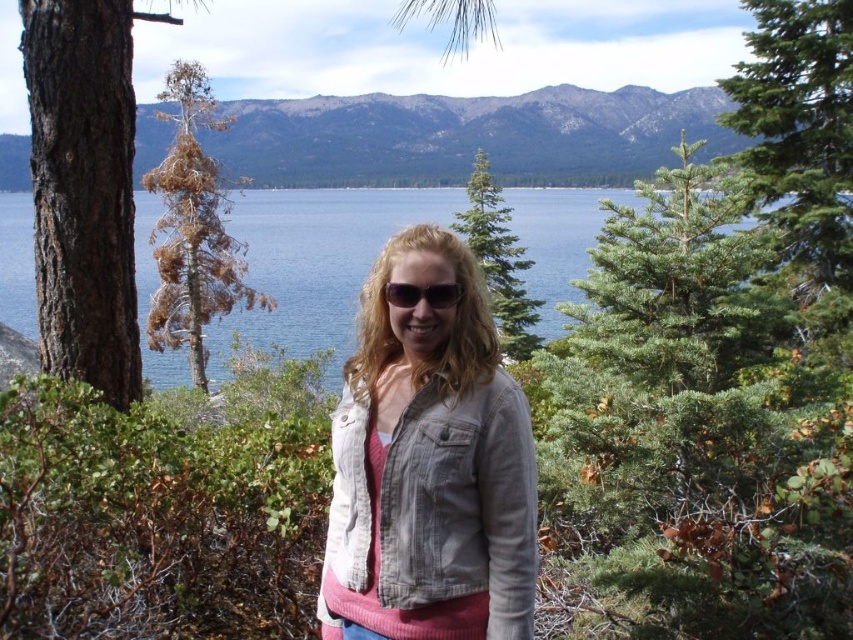
Question: Does blue water at center appear on the right side of sunglasses at center?

Choices:
 (A) yes
 (B) no

Answer: (B)

Question: Which point is closer to the camera taking this photo?

Choices:
 (A) (183, 104)
 (B) (268, 289)
 (C) (54, 131)

Answer: (C)

Question: Which point is farther to the camera?

Choices:
 (A) blue water at center
 (B) dark brown rough bark at left
 (C) green textured pine tree at center

Answer: (C)

Question: Considering the relative positions of blue water at center and brown/dried wood tree at left in the image provided, where is blue water at center located with respect to brown/dried wood tree at left?

Choices:
 (A) left
 (B) right

Answer: (B)

Question: Considering the relative positions of blue water at center and brown/dried wood tree at left in the image provided, where is blue water at center located with respect to brown/dried wood tree at left?

Choices:
 (A) right
 (B) left

Answer: (A)

Question: Considering the real-world distances, which object is farthest from the green textured pine tree at center?

Choices:
 (A) sunglasses at center
 (B) blue water at center
 (C) brown/dried wood tree at left

Answer: (A)